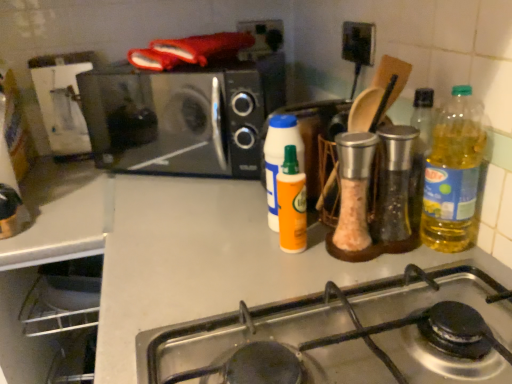
Identify the location of vacant area on the back side of orange matte bottle at center, which appears as the 4th bottle when viewed from the right. The height and width of the screenshot is (384, 512). coord(237,192).